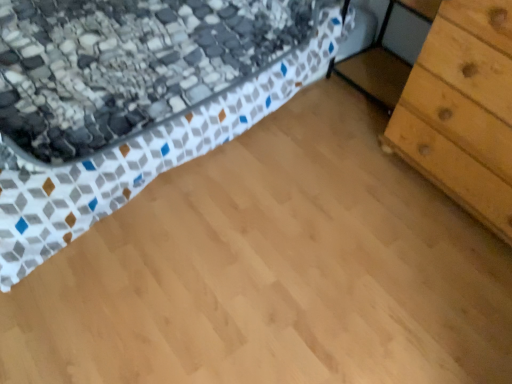
Question: Is light brown wood chest of drawers at right not within textured fabric bed at upper left?

Choices:
 (A) no
 (B) yes

Answer: (B)

Question: Could you tell me if light brown wood chest of drawers at right is facing textured fabric bed at upper left?

Choices:
 (A) yes
 (B) no

Answer: (B)

Question: Does light brown wood chest of drawers at right have a greater width compared to textured fabric bed at upper left?

Choices:
 (A) no
 (B) yes

Answer: (A)

Question: From the image's perspective, is light brown wood chest of drawers at right located beneath textured fabric bed at upper left?

Choices:
 (A) no
 (B) yes

Answer: (B)

Question: Is light brown wood chest of drawers at right facing away from textured fabric bed at upper left?

Choices:
 (A) yes
 (B) no

Answer: (B)

Question: Would you say light brown wood chest of drawers at right contains textured fabric bed at upper left?

Choices:
 (A) yes
 (B) no

Answer: (B)

Question: Does textured fabric bed at upper left lie behind light brown wood chest of drawers at right?

Choices:
 (A) yes
 (B) no

Answer: (B)

Question: Is textured fabric bed at upper left outside of light brown wood chest of drawers at right?

Choices:
 (A) yes
 (B) no

Answer: (A)

Question: Can you confirm if textured fabric bed at upper left is taller than light brown wood chest of drawers at right?

Choices:
 (A) yes
 (B) no

Answer: (B)

Question: From the image's perspective, is textured fabric bed at upper left under light brown wood chest of drawers at right?

Choices:
 (A) no
 (B) yes

Answer: (A)

Question: Is textured fabric bed at upper left bigger than light brown wood chest of drawers at right?

Choices:
 (A) yes
 (B) no

Answer: (A)

Question: From a real-world perspective, is textured fabric bed at upper left below light brown wood chest of drawers at right?

Choices:
 (A) yes
 (B) no

Answer: (A)

Question: From a real-world perspective, relative to light brown wood chest of drawers at right, is textured fabric bed at upper left vertically above or below?

Choices:
 (A) below
 (B) above

Answer: (A)